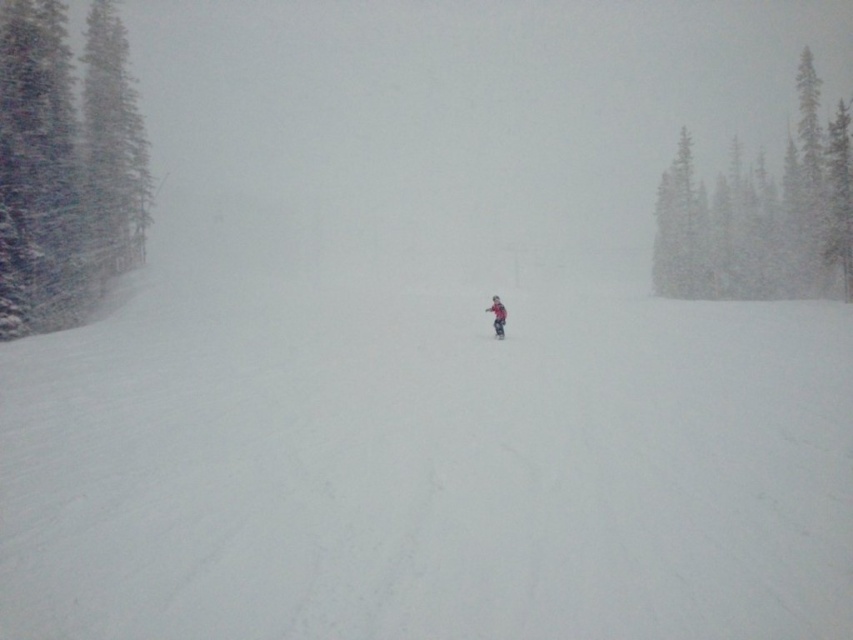
Between red matte ski at center and matte red ski at center, which one has more height?

Standing taller between the two is matte red ski at center.

Between red matte ski at center and matte red ski at center, which one is positioned lower?

red matte ski at center is below.

Which is in front, point (482, 336) or point (503, 332)?

Point (503, 332) is more forward.

Where is `red matte ski at center`? red matte ski at center is located at coordinates (498, 337).

Does red jacket at center have a larger size compared to matte red ski at center?

Yes, red jacket at center is bigger than matte red ski at center.

Who is positioned more to the right, red jacket at center or matte red ski at center?

From the viewer's perspective, red jacket at center appears more on the right side.

Between point (495, 328) and point (498, 336), which one is positioned behind?

Point (495, 328)

This screenshot has height=640, width=853. I want to click on red jacket at center, so click(x=497, y=316).

Is green textured pine trees at upper right to the left of matte red ski at center from the viewer's perspective?

No, green textured pine trees at upper right is not to the left of matte red ski at center.

Is green textured pine trees at upper right in front of matte red ski at center?

No, it is behind matte red ski at center.

Is point (743, 244) closer to viewer compared to point (498, 333)?

That is False.

Identify the location of green textured pine trees at upper right. (761, 216).